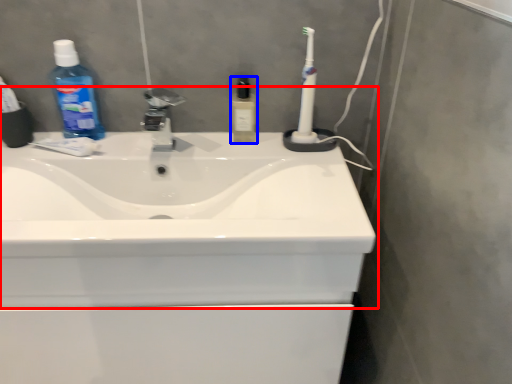
Question: Among these objects, which one is farthest to the camera, sink (highlighted by a red box) or toiletry (highlighted by a blue box)?

Choices:
 (A) sink
 (B) toiletry

Answer: (B)